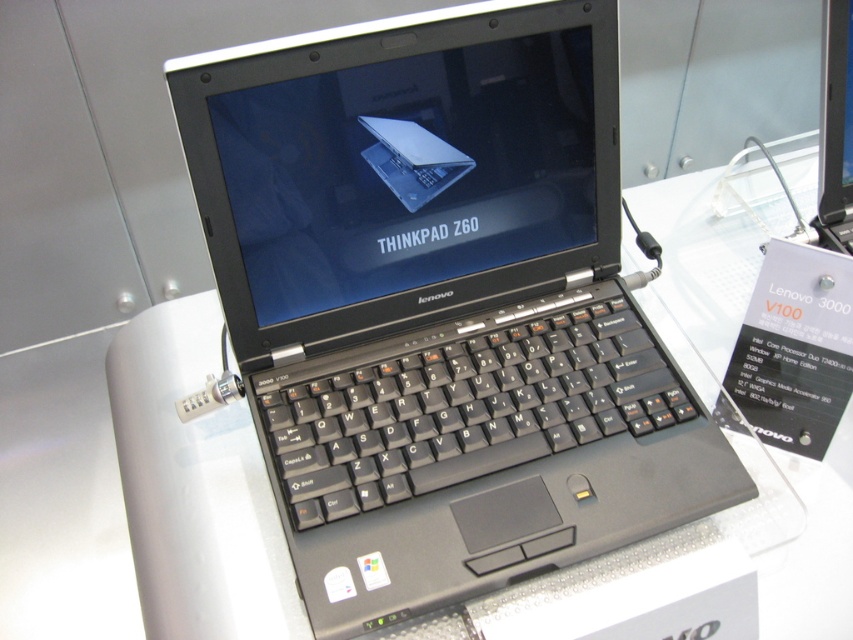
Does black plastic laptop at center have a larger size compared to sleek silver laptop at center?

Correct, black plastic laptop at center is larger in size than sleek silver laptop at center.

Is black plastic laptop at center further to the viewer compared to sleek silver laptop at center?

No, black plastic laptop at center is in front of sleek silver laptop at center.

Between point (366, 276) and point (392, 124), which one is positioned behind?

Point (366, 276)

The width and height of the screenshot is (853, 640). Find the location of `black plastic laptop at center`. black plastic laptop at center is located at coordinates (440, 307).